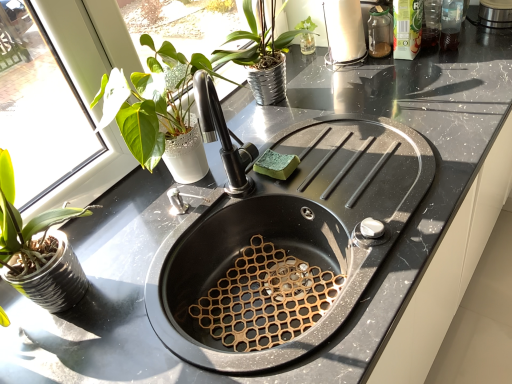
You are a GUI agent. You are given a task and a screenshot of the screen. Output one action in this format:
    pyautogui.click(x=<x>, y=<y>)
    Task: Click on the free space in front of green sponge at sink
    This screenshot has height=384, width=512.
    Given the screenshot: What is the action you would take?
    pyautogui.click(x=308, y=191)